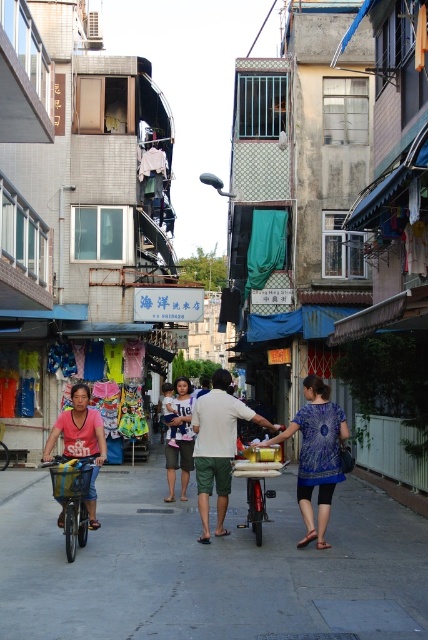
Question: From the image, what is the correct spatial relationship of gray concrete pavement at center in relation to blue denim shorts at center?

Choices:
 (A) right
 (B) left

Answer: (A)

Question: Among these points, which one is farthest from the camera?

Choices:
 (A) (118, 563)
 (B) (77, 465)
 (C) (332, 428)

Answer: (C)

Question: Which point is farther to the camera?

Choices:
 (A) blue printed blouse at center
 (B) blue denim shorts at center
 (C) metallic silver bicycle at center
 (D) gray concrete pavement at center

Answer: (B)

Question: Which point is farther to the camera?

Choices:
 (A) (302, 460)
 (B) (56, 470)

Answer: (A)

Question: Does metallic silver bicycle at center appear over blue denim shorts at center?

Choices:
 (A) yes
 (B) no

Answer: (A)

Question: Is blue printed blouse at center above green cotton shorts at center?

Choices:
 (A) no
 (B) yes

Answer: (B)